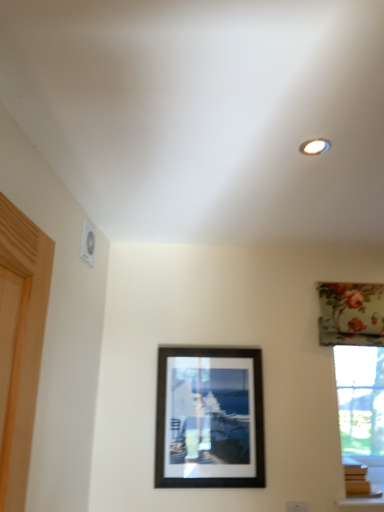
Describe the element at coordinates (351, 314) in the screenshot. I see `floral fabric curtain at upper right` at that location.

What is the approximate width of floral fabric curtain at upper right?

floral fabric curtain at upper right is 3.06 inches in width.

What is the approximate height of floral fabric curtain at upper right?

floral fabric curtain at upper right is 12.62 inches in height.

Measure the distance between point [351,298] and camera.

A distance of 2.02 meters exists between point [351,298] and camera.

Image resolution: width=384 pixels, height=512 pixels. In order to click on floral fabric curtain at upper right in this screenshot , I will do `click(351, 314)`.

You are a GUI agent. You are given a task and a screenshot of the screen. Output one action in this format:
    pyautogui.click(x=<x>, y=<y>)
    Task: Click on the black matte picture frame at center
    The image size is (384, 512).
    Given the screenshot: What is the action you would take?
    pyautogui.click(x=210, y=417)

The image size is (384, 512). What do you see at coordinates (210, 417) in the screenshot? I see `black matte picture frame at center` at bounding box center [210, 417].

The image size is (384, 512). I want to click on floral fabric curtain at upper right, so click(351, 314).

Visually, is floral fabric curtain at upper right positioned to the left or to the right of black matte picture frame at center?

Clearly, floral fabric curtain at upper right is on the right of black matte picture frame at center in the image.

Which object is further away from the camera, floral fabric curtain at upper right or black matte picture frame at center?

floral fabric curtain at upper right.

Is point (325, 313) closer to camera compared to point (228, 459)?

No, (325, 313) is behind (228, 459).

From the image's perspective, between floral fabric curtain at upper right and black matte picture frame at center, which one is located above?

floral fabric curtain at upper right, from the image's perspective.

From a real-world perspective, relative to black matte picture frame at center, is floral fabric curtain at upper right vertically above or below?

floral fabric curtain at upper right is situated higher than black matte picture frame at center in the real world.

Does floral fabric curtain at upper right have a greater width compared to black matte picture frame at center?

Yes.

Who is shorter, floral fabric curtain at upper right or black matte picture frame at center?

With less height is floral fabric curtain at upper right.

Does floral fabric curtain at upper right have a larger size compared to black matte picture frame at center?

No, floral fabric curtain at upper right is not bigger than black matte picture frame at center.

Is black matte picture frame at center located within floral fabric curtain at upper right?

No.

Are floral fabric curtain at upper right and black matte picture frame at center making contact?

They are not placed beside each other.

Is floral fabric curtain at upper right facing towards black matte picture frame at center?

No, floral fabric curtain at upper right is not oriented towards black matte picture frame at center.

Find the location of a particular element. The height and width of the screenshot is (512, 384). curtain behind the black matte picture frame at center is located at coordinates (351, 314).

Is black matte picture frame at center to the right of floral fabric curtain at upper right from the viewer's perspective?

No.

Considering the relative positions of black matte picture frame at center and floral fabric curtain at upper right in the image provided, is black matte picture frame at center behind floral fabric curtain at upper right?

No, it is in front of floral fabric curtain at upper right.

Which is nearer, (x=235, y=466) or (x=349, y=300)?

Point (x=235, y=466) is positioned closer to the camera compared to point (x=349, y=300).

From the image's perspective, does black matte picture frame at center appear higher than floral fabric curtain at upper right?

No, from the image's perspective, black matte picture frame at center is not over floral fabric curtain at upper right.

From a real-world perspective, is black matte picture frame at center physically below floral fabric curtain at upper right?

Yes, from a real-world perspective, black matte picture frame at center is below floral fabric curtain at upper right.

Can you confirm if black matte picture frame at center is thinner than floral fabric curtain at upper right?

Indeed, black matte picture frame at center has a lesser width compared to floral fabric curtain at upper right.

From the picture: Which of these two, black matte picture frame at center or floral fabric curtain at upper right, stands taller?

black matte picture frame at center.

Which of these two, black matte picture frame at center or floral fabric curtain at upper right, is bigger?

Bigger between the two is black matte picture frame at center.

Do you think black matte picture frame at center is within floral fabric curtain at upper right, or outside of it?

black matte picture frame at center is located beyond the bounds of floral fabric curtain at upper right.

Is black matte picture frame at center beside floral fabric curtain at upper right?

No.

Is black matte picture frame at center facing away from floral fabric curtain at upper right?

That's not correct — black matte picture frame at center is not looking away from floral fabric curtain at upper right.

How different are the orientations of black matte picture frame at center and floral fabric curtain at upper right in degrees?

The facing directions of black matte picture frame at center and floral fabric curtain at upper right are 0.0796 degrees apart.

Identify the location of curtain above the black matte picture frame at center (from a real-world perspective). The height and width of the screenshot is (512, 384). (351, 314).

The width and height of the screenshot is (384, 512). I want to click on curtain that is behind the black matte picture frame at center, so click(x=351, y=314).

This screenshot has height=512, width=384. I want to click on curtain that is above the black matte picture frame at center (from the image's perspective), so pos(351,314).